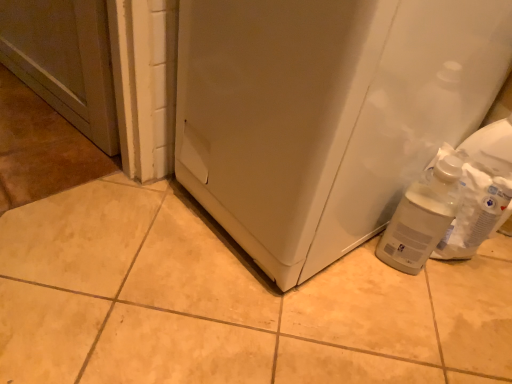
Question: Is point (393, 21) closer or farther from the camera than point (435, 236)?

Choices:
 (A) farther
 (B) closer

Answer: (B)

Question: From the image's perspective, is white matte refrigerator at lower right positioned above or below translucent plastic bottle at lower right?

Choices:
 (A) above
 (B) below

Answer: (A)

Question: From a real-world perspective, relative to translucent plastic bottle at lower right, is white matte refrigerator at lower right vertically above or below?

Choices:
 (A) above
 (B) below

Answer: (A)

Question: From a real-world perspective, is translucent plastic bottle at lower right physically located above or below white matte refrigerator at lower right?

Choices:
 (A) below
 (B) above

Answer: (A)

Question: Based on their positions, is translucent plastic bottle at lower right located to the left or right of white matte refrigerator at lower right?

Choices:
 (A) right
 (B) left

Answer: (A)

Question: Relative to white matte refrigerator at lower right, is translucent plastic bottle at lower right in front or behind?

Choices:
 (A) front
 (B) behind

Answer: (B)

Question: From their relative heights in the image, would you say translucent plastic bottle at lower right is taller or shorter than white matte refrigerator at lower right?

Choices:
 (A) tall
 (B) short

Answer: (B)